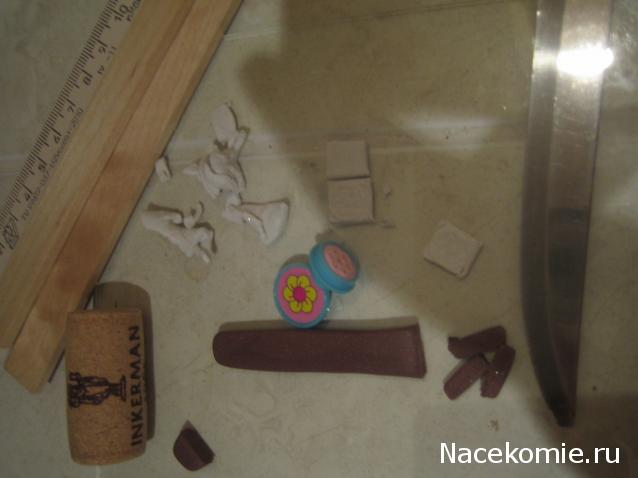
Locate an element on the screen. The height and width of the screenshot is (478, 638). wine stopper is located at coordinates (114, 350).